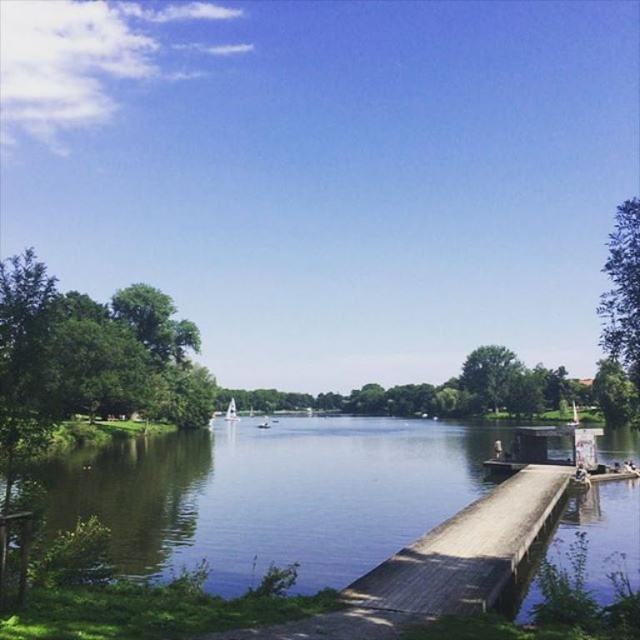
Is smooth brown water at center above wooden dock at lower right?

No, smooth brown water at center is not above wooden dock at lower right.

Is smooth brown water at center shorter than wooden dock at lower right?

No, smooth brown water at center is not shorter than wooden dock at lower right.

This screenshot has height=640, width=640. Find the location of `smooth brown water at center`. smooth brown water at center is located at coordinates (273, 493).

Does point (333, 628) come farther from viewer compared to point (232, 406)?

No, (333, 628) is in front of (232, 406).

Between point (262, 637) and point (234, 417), which one is positioned in front?

Point (262, 637)

Which is behind, point (442, 586) or point (237, 417)?

Point (237, 417)

Where is `wooden dock at lower right`? wooden dock at lower right is located at coordinates (436, 566).

Does smooth brown water at center have a lesser height compared to white glossy sailboat at center?

No, smooth brown water at center is not shorter than white glossy sailboat at center.

Between smooth brown water at center and white glossy sailboat at center, which one has less height?

With less height is white glossy sailboat at center.

This screenshot has height=640, width=640. Find the location of `smooth brown water at center`. smooth brown water at center is located at coordinates (273, 493).

Where is `smooth brown water at center`? The image size is (640, 640). smooth brown water at center is located at coordinates (273, 493).